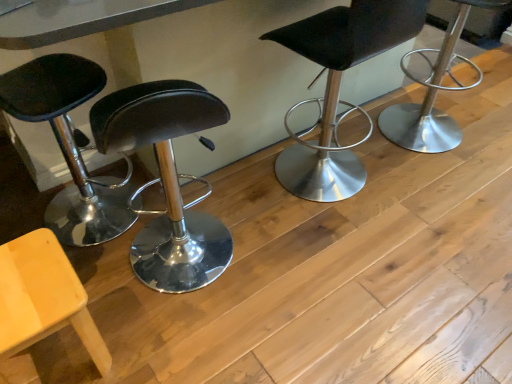
Question: From the image's perspective, would you say matte yellow chair at lower left, the 2th chair in the left-to-right sequence, is shown under polished silver stool at right, the first chair positioned from the right?

Choices:
 (A) no
 (B) yes

Answer: (B)

Question: Does matte yellow chair at lower left, the 2th chair in the left-to-right sequence, have a larger size compared to polished silver stool at right, the first chair positioned from the right?

Choices:
 (A) no
 (B) yes

Answer: (A)

Question: Considering the relative positions of matte yellow chair at lower left, which ranks as the third chair in right-to-left order, and polished silver stool at right, the 4th chair in the left-to-right sequence, in the image provided, is matte yellow chair at lower left, which ranks as the third chair in right-to-left order, behind polished silver stool at right, the 4th chair in the left-to-right sequence,?

Choices:
 (A) no
 (B) yes

Answer: (A)

Question: From a real-world perspective, is matte yellow chair at lower left, the 2th chair in the left-to-right sequence, located higher than polished silver stool at right, the 4th chair in the left-to-right sequence?

Choices:
 (A) yes
 (B) no

Answer: (B)

Question: From the image's perspective, is matte yellow chair at lower left, the 2th chair in the left-to-right sequence, over polished silver stool at right, the 4th chair in the left-to-right sequence?

Choices:
 (A) yes
 (B) no

Answer: (B)

Question: Is matte yellow chair at lower left, the 2th chair in the left-to-right sequence, facing away from polished silver stool at right, the first chair positioned from the right?

Choices:
 (A) yes
 (B) no

Answer: (B)

Question: Does matte yellow chair at lower left, which ranks as the third chair in right-to-left order, contain matte black stool at left, arranged as the fourth chair when viewed from the right?

Choices:
 (A) yes
 (B) no

Answer: (B)

Question: Is the position of matte yellow chair at lower left, which ranks as the third chair in right-to-left order, more distant than that of matte black stool at left, arranged as the fourth chair when viewed from the right?

Choices:
 (A) no
 (B) yes

Answer: (A)

Question: From a real-world perspective, is matte yellow chair at lower left, the 2th chair in the left-to-right sequence, located higher than matte black stool at left, which appears as the 1th chair when viewed from the left?

Choices:
 (A) no
 (B) yes

Answer: (A)

Question: From a real-world perspective, is matte yellow chair at lower left, the 2th chair in the left-to-right sequence, beneath matte black stool at left, arranged as the fourth chair when viewed from the right?

Choices:
 (A) no
 (B) yes

Answer: (B)

Question: Does matte yellow chair at lower left, which ranks as the third chair in right-to-left order, have a smaller size compared to matte black stool at left, arranged as the fourth chair when viewed from the right?

Choices:
 (A) no
 (B) yes

Answer: (B)

Question: From the image's perspective, is matte yellow chair at lower left, which ranks as the third chair in right-to-left order, above matte black stool at left, which appears as the 1th chair when viewed from the left?

Choices:
 (A) yes
 (B) no

Answer: (B)

Question: Does polished silver stool at right, the 4th chair in the left-to-right sequence, appear on the left side of black leather stool at center, positioned as the 2th chair in right-to-left order?

Choices:
 (A) yes
 (B) no

Answer: (B)